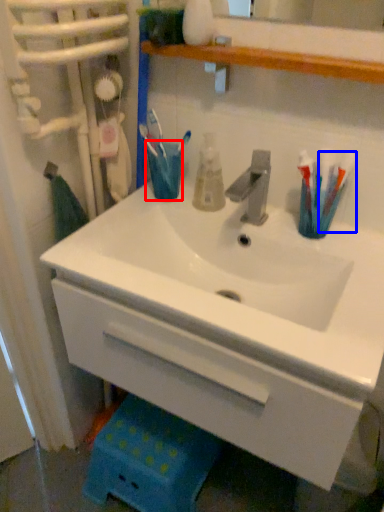
Question: Which of the following is the closest to the observer, turquoise (highlighted by a red box) or toothbrush (highlighted by a blue box)?

Choices:
 (A) turquoise
 (B) toothbrush

Answer: (B)